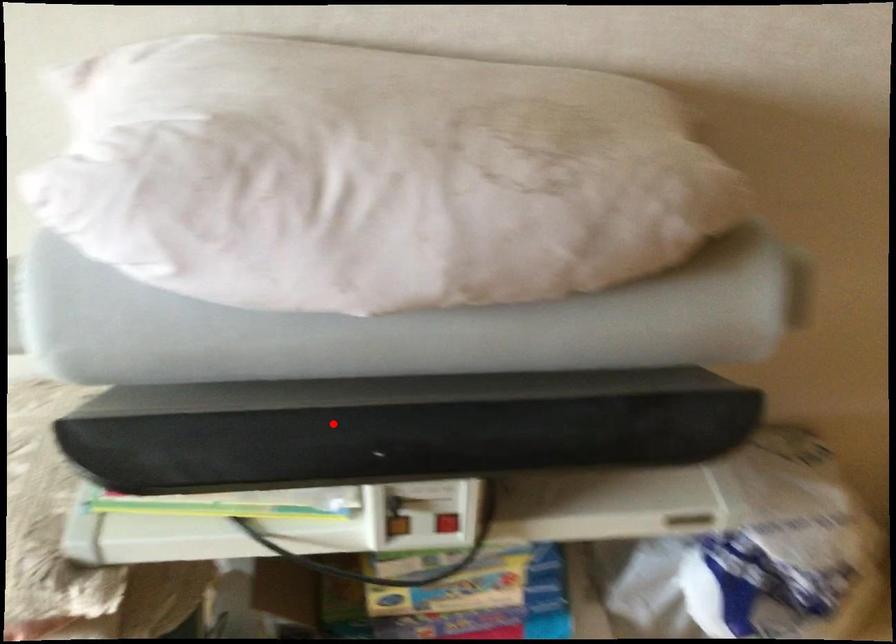
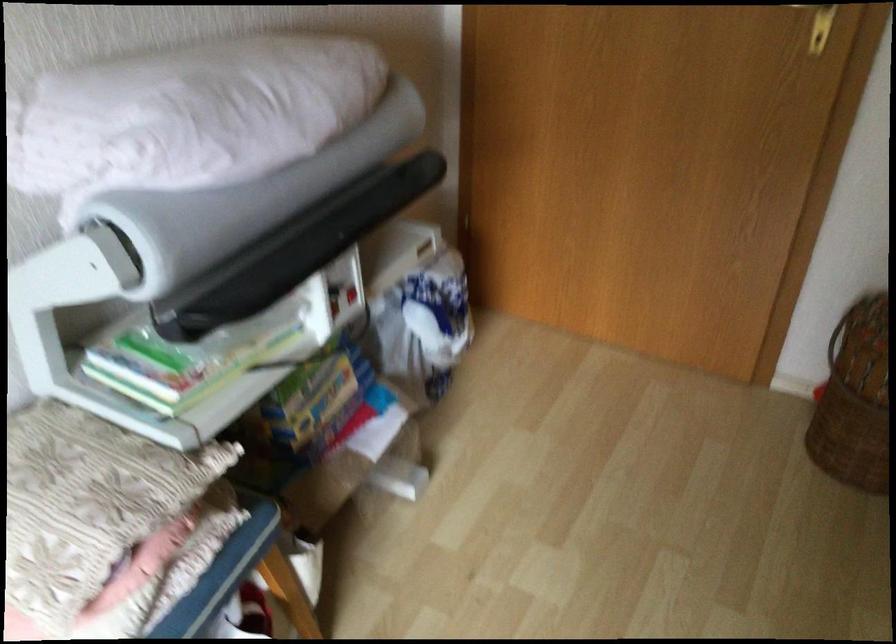
In the second image, find the point that corresponds to the highlighted location in the first image.

(295, 249)